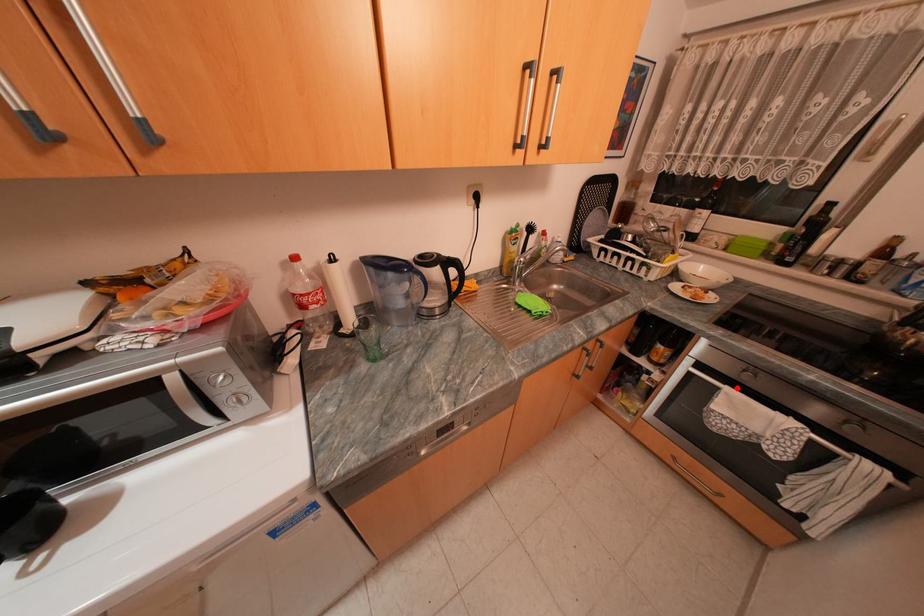
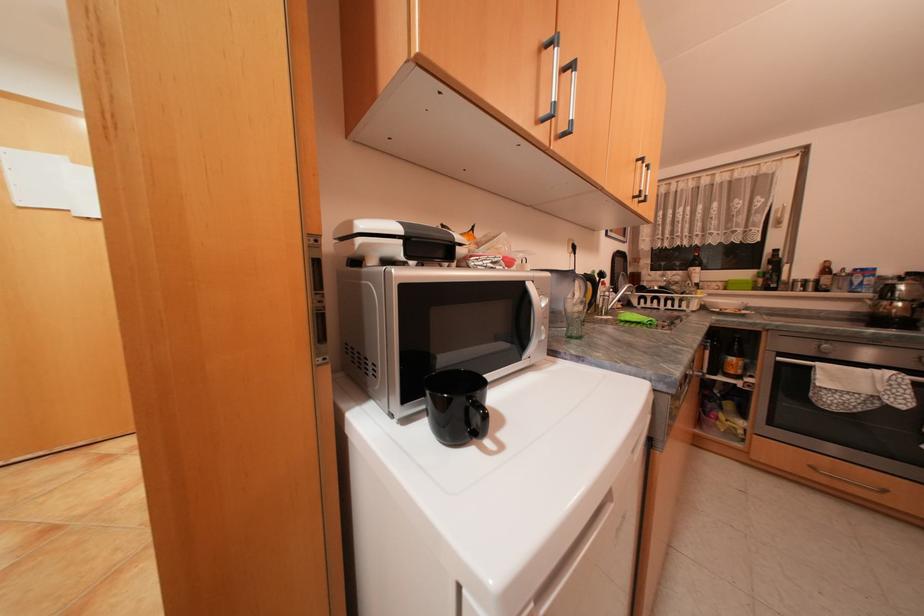
Find the pixel in the second image that matches the highlighted location in the first image.

(830, 363)